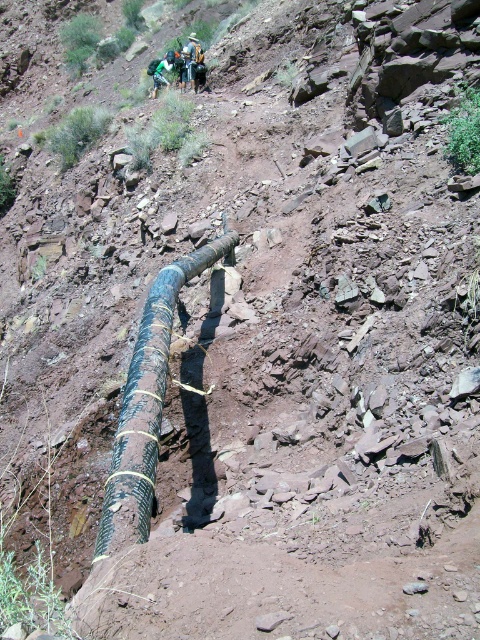
You are navigating a rocky terrain and need to place a marker at the point that is closer to you. Which coordinate should you choose between point (x=143, y=436) and point (x=184, y=65)?

Point (x=143, y=436) is in front of point (x=184, y=65), so you should choose point (x=143, y=436) as it is closer to you.

You are a hiker navigating the rugged terrain and need to locate your gear. You remember placing your brushed metal backpack at upper center. Based on the scene, where would you look relative to the large dark pipe?

The brushed metal backpack at upper center is located at coordinates [190,60], which places it near the upper part of the scene relative to the large dark pipe running diagonally across the foreground.